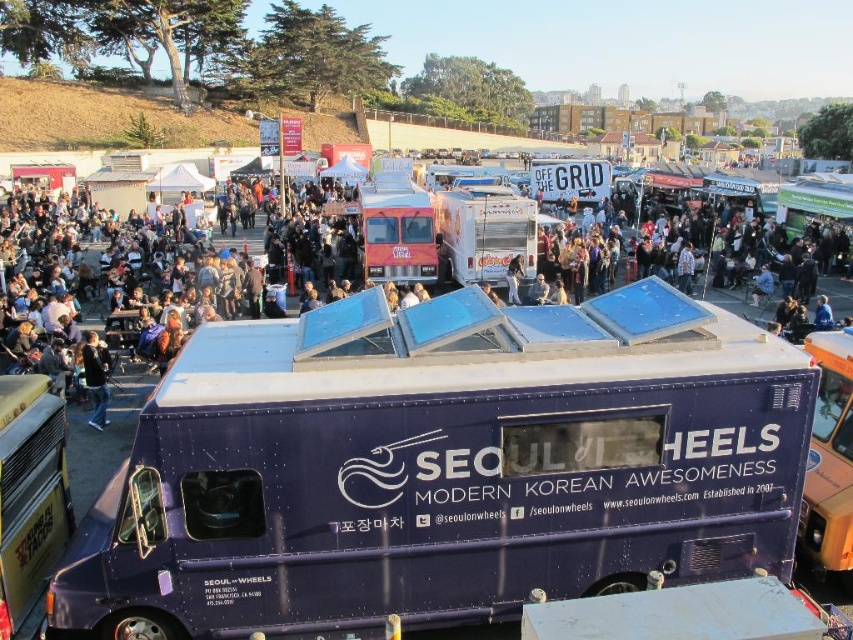
Which is more to the right, metallic purple food truck at center or silver metallic food truck at center?

metallic purple food truck at center is more to the right.

Is metallic purple food truck at center above silver metallic food truck at center?

No, metallic purple food truck at center is not above silver metallic food truck at center.

Image resolution: width=853 pixels, height=640 pixels. What are the coordinates of `metallic purple food truck at center` in the screenshot? It's located at (442, 467).

From the picture: Who is taller, metallic purple food truck at center or dark blue jeans at lower left?

dark blue jeans at lower left is taller.

Between metallic purple food truck at center and dark blue jeans at lower left, which one is positioned higher?

dark blue jeans at lower left

Is point (109, 593) closer to camera compared to point (86, 364)?

Yes, it is.

This screenshot has height=640, width=853. I want to click on metallic purple food truck at center, so click(x=442, y=467).

Is point (515, 241) closer to viewer compared to point (103, 416)?

No.

Is point (456, 262) positioned after point (97, 371)?

Yes, it is behind point (97, 371).

Image resolution: width=853 pixels, height=640 pixels. In order to click on silver metallic food truck at center in this screenshot , I will do `click(485, 234)`.